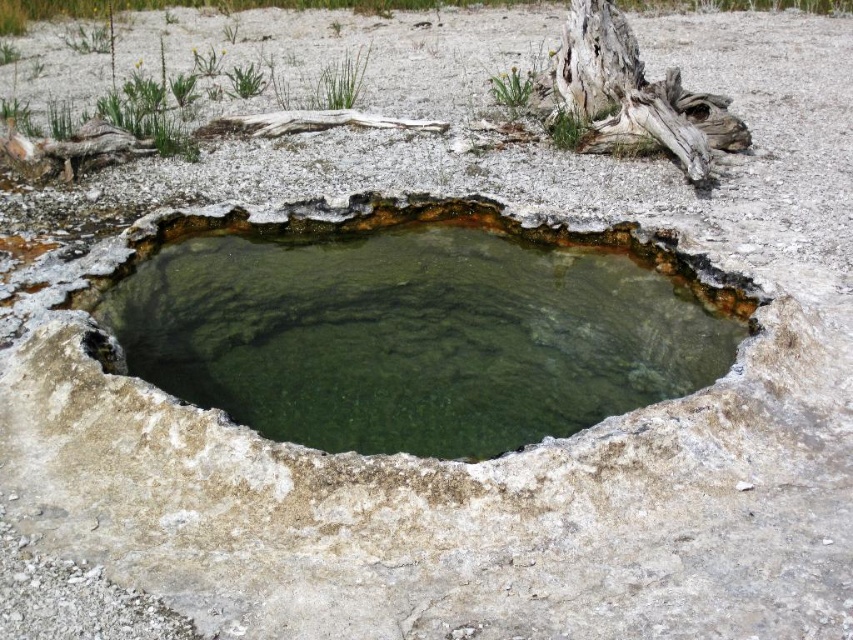
You are standing at the edge of the green stone pond at center and want to reach the green algae at upper left. Which direction should you move to get there?

You should move to the left because the green stone pond at center is to the right of the green algae at upper left.